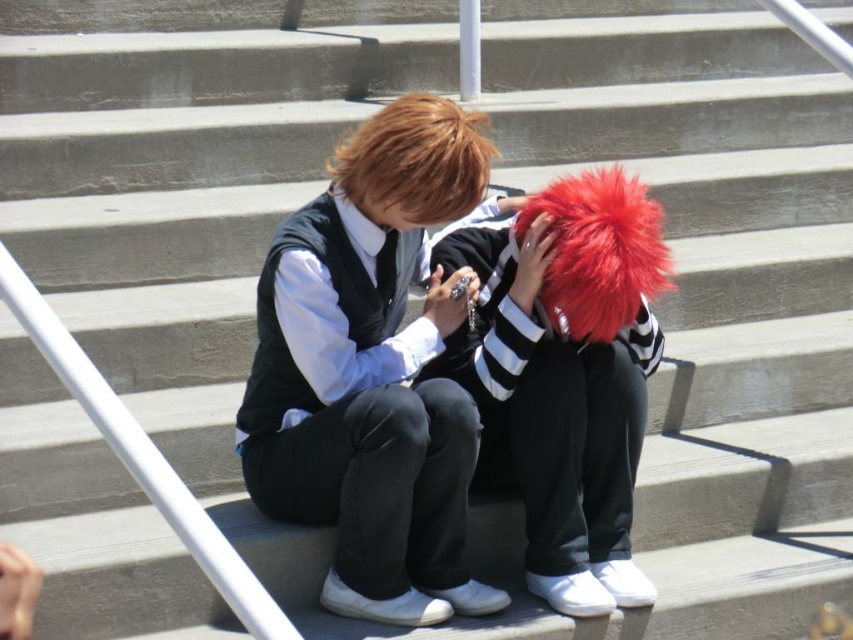
Between fluffy red wig at center and shiny brown hair at upper center, which one is positioned higher?

shiny brown hair at upper center

Consider the image. Is fluffy red wig at center taller than shiny brown hair at upper center?

Yes.

This screenshot has width=853, height=640. Find the location of `fluffy red wig at center`. fluffy red wig at center is located at coordinates (566, 374).

Where is `fluffy red wig at center`? The height and width of the screenshot is (640, 853). fluffy red wig at center is located at coordinates (566, 374).

Is point (270, 508) positioned behind point (616, 324)?

Yes, it is.

Is point (306, 248) farther from camera compared to point (598, 312)?

That is False.

I want to click on matte black vest at center, so click(x=372, y=371).

Does point (407, 531) lie behind point (410, 220)?

That is True.

Can you confirm if matte black vest at center is bigger than shiny brown hair at upper center?

Yes.

I want to click on matte black vest at center, so click(372, 371).

The height and width of the screenshot is (640, 853). What are the coordinates of `matte black vest at center` in the screenshot? It's located at (372, 371).